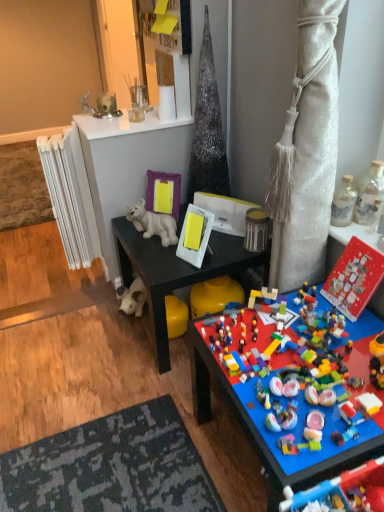
I want to click on vacant point to the left of multicolored plastic lego pieces at lower right, which is counted as the seventh toy, starting from the top, so click(x=145, y=438).